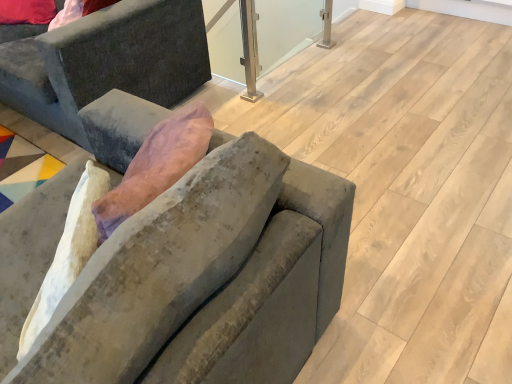
Question: Is velvet gray couch at left, acting as the second studio couch starting from the front, at the right side of velvet gray couch at center, which appears as the first studio couch when viewed from the front?

Choices:
 (A) yes
 (B) no

Answer: (B)

Question: Considering the relative sizes of velvet gray couch at left, which appears as the first studio couch when viewed from the back, and velvet gray couch at center, acting as the 1th studio couch starting from the bottom, in the image provided, is velvet gray couch at left, which appears as the first studio couch when viewed from the back, taller than velvet gray couch at center, acting as the 1th studio couch starting from the bottom,?

Choices:
 (A) no
 (B) yes

Answer: (A)

Question: From the image's perspective, is velvet gray couch at left, which ranks as the 2th studio couch in bottom-to-top order, below velvet gray couch at center, acting as the 1th studio couch starting from the bottom?

Choices:
 (A) no
 (B) yes

Answer: (A)

Question: Can you confirm if velvet gray couch at left, which appears as the first studio couch when viewed from the back, is bigger than velvet gray couch at center, positioned as the 2th studio couch in top-to-bottom order?

Choices:
 (A) yes
 (B) no

Answer: (A)

Question: Does velvet gray couch at left, the 1th studio couch when ordered from top to bottom, have a lesser width compared to velvet gray couch at center, which appears as the first studio couch when viewed from the front?

Choices:
 (A) yes
 (B) no

Answer: (B)

Question: Considering the positions of clear glass window screen at center and velvet gray couch at left, which ranks as the 2th studio couch in bottom-to-top order, in the image, is clear glass window screen at center bigger or smaller than velvet gray couch at left, which ranks as the 2th studio couch in bottom-to-top order,?

Choices:
 (A) small
 (B) big

Answer: (A)

Question: In the image, is clear glass window screen at center on the left side or the right side of velvet gray couch at left, which appears as the first studio couch when viewed from the back?

Choices:
 (A) right
 (B) left

Answer: (A)

Question: Is point (263, 67) positioned closer to the camera than point (185, 28)?

Choices:
 (A) farther
 (B) closer

Answer: (A)

Question: Choose the correct answer: Is clear glass window screen at center inside velvet gray couch at left, acting as the second studio couch starting from the front, or outside it?

Choices:
 (A) outside
 (B) inside

Answer: (A)

Question: From a real-world perspective, relative to velvet gray couch at center, acting as the 1th studio couch starting from the bottom, is velvet gray couch at left, acting as the second studio couch starting from the front, vertically above or below?

Choices:
 (A) above
 (B) below

Answer: (B)

Question: Based on their sizes in the image, would you say velvet gray couch at left, which appears as the first studio couch when viewed from the back, is bigger or smaller than velvet gray couch at center, acting as the 1th studio couch starting from the bottom?

Choices:
 (A) small
 (B) big

Answer: (B)

Question: Considering the positions of velvet gray couch at left, acting as the second studio couch starting from the front, and velvet gray couch at center, positioned as the 2th studio couch in back-to-front order, in the image, is velvet gray couch at left, acting as the second studio couch starting from the front, wider or thinner than velvet gray couch at center, positioned as the 2th studio couch in back-to-front order,?

Choices:
 (A) thin
 (B) wide

Answer: (B)

Question: Is velvet gray couch at left, which ranks as the 2th studio couch in bottom-to-top order, inside or outside of velvet gray couch at center, positioned as the 2th studio couch in top-to-bottom order?

Choices:
 (A) outside
 (B) inside

Answer: (A)

Question: From a real-world perspective, is velvet gray couch at center, acting as the 1th studio couch starting from the bottom, above or below velvet gray couch at left, which appears as the first studio couch when viewed from the back?

Choices:
 (A) above
 (B) below

Answer: (A)

Question: From the image's perspective, relative to velvet gray couch at left, which appears as the first studio couch when viewed from the back, is velvet gray couch at center, positioned as the 2th studio couch in back-to-front order, above or below?

Choices:
 (A) below
 (B) above

Answer: (A)